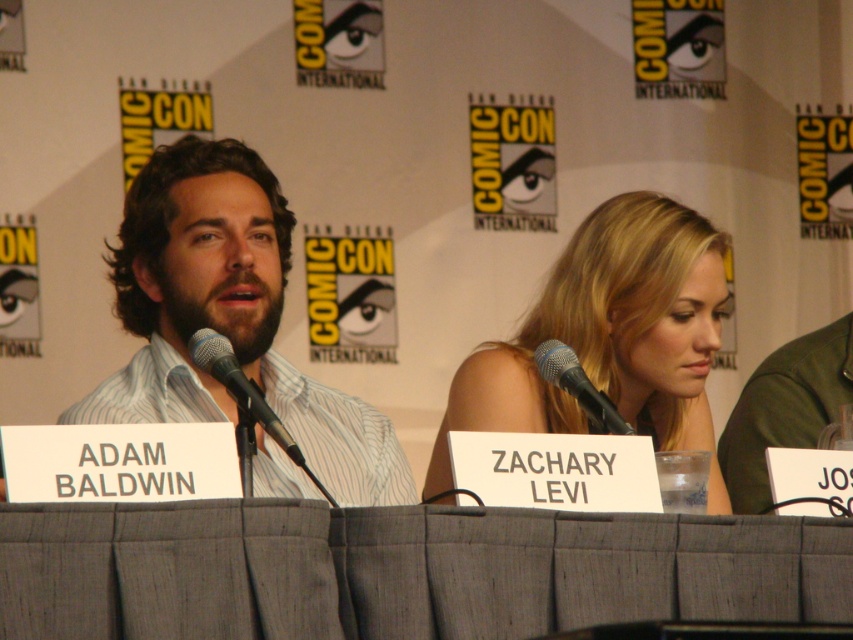
Question: Does gray fabric table at center appear on the left side of black matte microphone at center?

Choices:
 (A) yes
 (B) no

Answer: (B)

Question: Can you confirm if blonde hair at center is wider than black matte microphone at center?

Choices:
 (A) yes
 (B) no

Answer: (A)

Question: Which object is closer to the camera taking this photo?

Choices:
 (A) silver metallic microphone at center
 (B) blonde hair at center
 (C) gray fabric table at center
 (D) black matte microphone at center

Answer: (C)

Question: Which object appears farthest from the camera in this image?

Choices:
 (A) blonde hair at center
 (B) black matte microphone at center

Answer: (A)

Question: Is blonde hair at center positioned behind silver metallic microphone at center?

Choices:
 (A) yes
 (B) no

Answer: (A)

Question: Which of these objects is positioned farthest from the white striped shirt at center?

Choices:
 (A) black matte microphone at center
 (B) blonde hair at center
 (C) silver metallic microphone at center

Answer: (A)